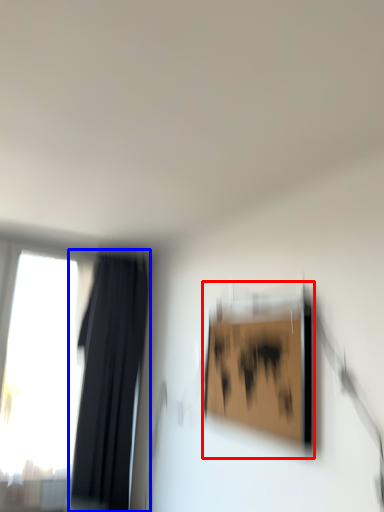
Question: Which point is further to the camera, picture frame (highlighted by a red box) or curtain (highlighted by a blue box)?

Choices:
 (A) picture frame
 (B) curtain

Answer: (B)